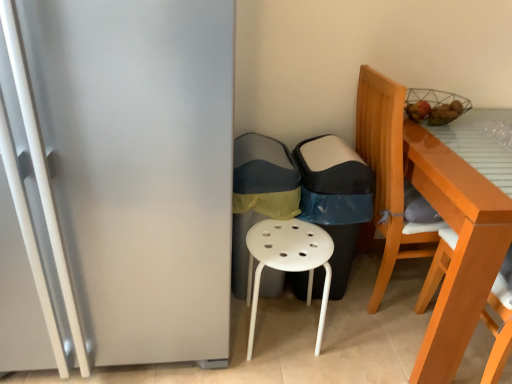
Where is `light brown wooden chair at right, the 1th chair in the right-to-left sequence`? This screenshot has height=384, width=512. light brown wooden chair at right, the 1th chair in the right-to-left sequence is located at coordinates (498, 329).

How much space does gray fabric trash can at center, positioned as the first garbage in left-to-right order, occupy vertically?

The height of gray fabric trash can at center, positioned as the first garbage in left-to-right order, is 27.46 inches.

How much space does gray fabric trash can at center, positioned as the first garbage in left-to-right order, occupy horizontally?

It is 15.49 inches.

You are a GUI agent. You are given a task and a screenshot of the screen. Output one action in this format:
    pyautogui.click(x=<x>, y=<y>)
    Task: Click on the black plastic trash can at center, the second garbage viewed from the left
    The width and height of the screenshot is (512, 384).
    Given the screenshot: What is the action you would take?
    pyautogui.click(x=335, y=198)

Considering the positions of objects black plastic trash can at center, the second garbage viewed from the left, and light brown wooden chair at right, the 2th chair in the left-to-right sequence, in the image provided, who is more to the left, black plastic trash can at center, the second garbage viewed from the left, or light brown wooden chair at right, the 2th chair in the left-to-right sequence,?

From the viewer's perspective, black plastic trash can at center, the second garbage viewed from the left, appears more on the left side.

Can we say black plastic trash can at center, the second garbage viewed from the left, lies outside light brown wooden chair at right, the 1th chair in the right-to-left sequence?

black plastic trash can at center, the second garbage viewed from the left, lies outside light brown wooden chair at right, the 1th chair in the right-to-left sequence,'s area.

Considering the relative sizes of black plastic trash can at center, the 1th garbage when ordered from right to left, and light brown wooden chair at right, the 1th chair in the right-to-left sequence, in the image provided, is black plastic trash can at center, the 1th garbage when ordered from right to left, smaller than light brown wooden chair at right, the 1th chair in the right-to-left sequence,?

Correct, black plastic trash can at center, the 1th garbage when ordered from right to left, occupies less space than light brown wooden chair at right, the 1th chair in the right-to-left sequence.

Does point (290, 251) appear closer or farther from the camera than point (273, 197)?

Clearly, point (290, 251) is closer to the camera than point (273, 197).

Considering the relative sizes of white plastic stool at center and gray fabric trash can at center, positioned as the 2th garbage in right-to-left order, in the image provided, is white plastic stool at center taller than gray fabric trash can at center, positioned as the 2th garbage in right-to-left order,?

No.

From the image's perspective, between white plastic stool at center and gray fabric trash can at center, positioned as the 2th garbage in right-to-left order, which one is located above?

gray fabric trash can at center, positioned as the 2th garbage in right-to-left order, appears higher in the image.

Is white plastic stool at center turned away from gray fabric trash can at center, positioned as the first garbage in left-to-right order?

Absolutely, white plastic stool at center is directed away from gray fabric trash can at center, positioned as the first garbage in left-to-right order.

Between gray fabric trash can at center, positioned as the 2th garbage in right-to-left order, and white plastic stool at center, which one appears on the right side from the viewer's perspective?

From the viewer's perspective, white plastic stool at center appears more on the right side.

Who is more distant, gray fabric trash can at center, positioned as the 2th garbage in right-to-left order, or white plastic stool at center?

Positioned behind is gray fabric trash can at center, positioned as the 2th garbage in right-to-left order.

Considering the positions of points (245, 287) and (316, 239), is point (245, 287) closer to camera compared to point (316, 239)?

No, (245, 287) is behind (316, 239).

Which of these two, black plastic trash can at center, the second garbage viewed from the left, or satin silver fridge at left, is smaller?

black plastic trash can at center, the second garbage viewed from the left.

Are black plastic trash can at center, the 1th garbage when ordered from right to left, and satin silver fridge at left beside each other?

No, black plastic trash can at center, the 1th garbage when ordered from right to left, is not beside satin silver fridge at left.

Which object is closer to the camera taking this photo, black plastic trash can at center, the 1th garbage when ordered from right to left, or satin silver fridge at left?

Positioned in front is satin silver fridge at left.

Is black plastic trash can at center, the 1th garbage when ordered from right to left, shorter than satin silver fridge at left?

Correct, black plastic trash can at center, the 1th garbage when ordered from right to left, is not as tall as satin silver fridge at left.

Is wooden chair at right, marked as the 1th chair in a left-to-right arrangement, in front of or behind light brown wooden chair at right, the 2th chair in the left-to-right sequence, in the image?

Visually, wooden chair at right, marked as the 1th chair in a left-to-right arrangement, is located behind light brown wooden chair at right, the 2th chair in the left-to-right sequence.

Which is behind, point (398, 226) or point (501, 360)?

Point (398, 226)

From a real-world perspective, is wooden chair at right, the second chair from the right, located higher than light brown wooden chair at right, the 1th chair in the right-to-left sequence?

No, from a real-world perspective, wooden chair at right, the second chair from the right, is not over light brown wooden chair at right, the 1th chair in the right-to-left sequence

Is wooden chair at right, the second chair from the right, facing away from light brown wooden chair at right, the 1th chair in the right-to-left sequence?

No, light brown wooden chair at right, the 1th chair in the right-to-left sequence, is not at the back of wooden chair at right, the second chair from the right.

In terms of size, does satin silver fridge at left appear bigger or smaller than wooden chair at right, marked as the 1th chair in a left-to-right arrangement?

Considering their sizes, satin silver fridge at left takes up more space than wooden chair at right, marked as the 1th chair in a left-to-right arrangement.

Which object is wider, satin silver fridge at left or wooden chair at right, the second chair from the right?

satin silver fridge at left is wider.

In the image, is satin silver fridge at left positioned in front of or behind wooden chair at right, the second chair from the right?

Visually, satin silver fridge at left is located in front of wooden chair at right, the second chair from the right.

Is wooden chair at right, marked as the 1th chair in a left-to-right arrangement, at the back of satin silver fridge at left?

satin silver fridge at left does not have its back to wooden chair at right, marked as the 1th chair in a left-to-right arrangement.

From the image's perspective, which one is positioned lower, satin silver fridge at left or light brown wooden chair at right, the 2th chair in the left-to-right sequence?

From the image's view, light brown wooden chair at right, the 2th chair in the left-to-right sequence, is below.

Would you say satin silver fridge at left is to the left or to the right of light brown wooden chair at right, the 1th chair in the right-to-left sequence, in the picture?

In the image, satin silver fridge at left appears on the left side of light brown wooden chair at right, the 1th chair in the right-to-left sequence.

Which object is closer to the camera, satin silver fridge at left or light brown wooden chair at right, the 1th chair in the right-to-left sequence?

Positioned in front is satin silver fridge at left.

From the black plastic trash can at center, the 1th garbage when ordered from right to left, count 2nd chair to the right and point to it. Please provide its 2D coordinates.

[(498, 329)]

From a real-world perspective, count 2nd garbages upward from the white plastic stool at center and point to it. Please provide its 2D coordinates.

[(259, 196)]

Looking at this image, from the image, which object appears to be farther from satin silver fridge at left, black plastic trash can at center, the 1th garbage when ordered from right to left, or wooden chair at right, marked as the 1th chair in a left-to-right arrangement?

The object further to satin silver fridge at left is wooden chair at right, marked as the 1th chair in a left-to-right arrangement.

Consider the image. When comparing their distances from light brown wooden chair at right, the 2th chair in the left-to-right sequence, does gray fabric trash can at center, positioned as the first garbage in left-to-right order, or wooden chair at right, marked as the 1th chair in a left-to-right arrangement, seem further?

gray fabric trash can at center, positioned as the first garbage in left-to-right order, is further to light brown wooden chair at right, the 2th chair in the left-to-right sequence.

From the image, which object appears to be farther from wooden chair at right, marked as the 1th chair in a left-to-right arrangement, gray fabric trash can at center, positioned as the first garbage in left-to-right order, or satin silver fridge at left?

satin silver fridge at left lies further to wooden chair at right, marked as the 1th chair in a left-to-right arrangement, than the other object.

Considering their positions, is satin silver fridge at left positioned further to white plastic stool at center than gray fabric trash can at center, positioned as the first garbage in left-to-right order?

satin silver fridge at left lies further to white plastic stool at center than the other object.

Looking at the image, which one is located closer to black plastic trash can at center, the second garbage viewed from the left, satin silver fridge at left or wooden chair at right, the second chair from the right?

wooden chair at right, the second chair from the right, is closer to black plastic trash can at center, the second garbage viewed from the left.

From the image, which object appears to be nearer to black plastic trash can at center, the 1th garbage when ordered from right to left, wooden chair at right, the second chair from the right, or satin silver fridge at left?

wooden chair at right, the second chair from the right.

Looking at the image, which one is located further to light brown wooden chair at right, the 1th chair in the right-to-left sequence, black plastic trash can at center, the second garbage viewed from the left, or satin silver fridge at left?

Among the two, satin silver fridge at left is located further to light brown wooden chair at right, the 1th chair in the right-to-left sequence.

Looking at the image, which one is located further to light brown wooden chair at right, the 1th chair in the right-to-left sequence, wooden chair at right, marked as the 1th chair in a left-to-right arrangement, or gray fabric trash can at center, positioned as the first garbage in left-to-right order?

Based on the image, gray fabric trash can at center, positioned as the first garbage in left-to-right order, appears to be further to light brown wooden chair at right, the 1th chair in the right-to-left sequence.

Image resolution: width=512 pixels, height=384 pixels. Find the location of `garbage between gray fabric trash can at center, positioned as the first garbage in left-to-right order, and wooden chair at right, the second chair from the right, from left to right`. garbage between gray fabric trash can at center, positioned as the first garbage in left-to-right order, and wooden chair at right, the second chair from the right, from left to right is located at coordinates (335, 198).

The height and width of the screenshot is (384, 512). I want to click on garbage situated between white plastic stool at center and wooden chair at right, the second chair from the right, from left to right, so click(335, 198).

Identify the location of chair between black plastic trash can at center, the second garbage viewed from the left, and light brown wooden chair at right, the 2th chair in the left-to-right sequence. The image size is (512, 384). (387, 177).

This screenshot has height=384, width=512. Identify the location of stool between gray fabric trash can at center, positioned as the 2th garbage in right-to-left order, and wooden chair at right, marked as the 1th chair in a left-to-right arrangement, in the horizontal direction. (290, 260).